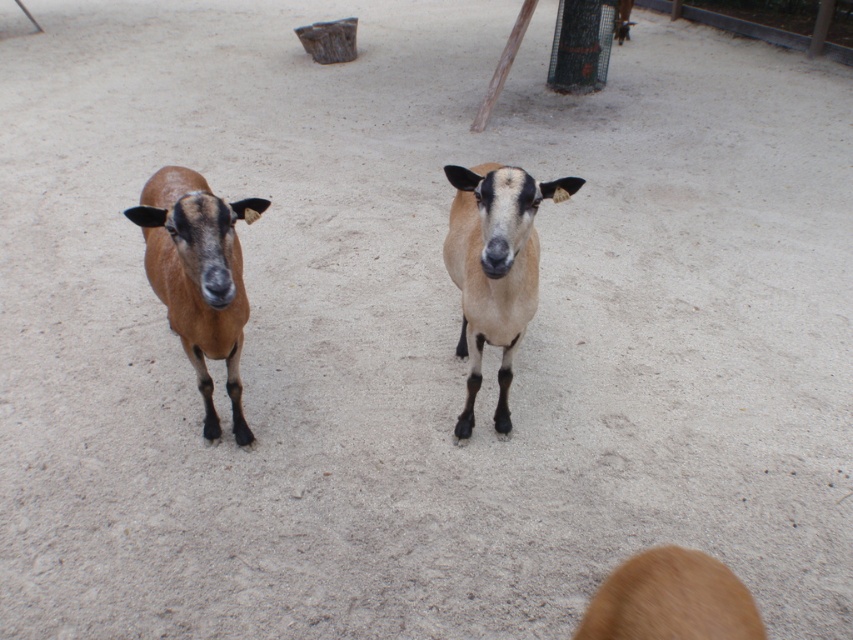
Question: Among these objects, which one is nearest to the camera?

Choices:
 (A) light brown fur goat at center
 (B) brown fur at lower right

Answer: (B)

Question: Is brown matte goat at left wider than brown fur at lower right?

Choices:
 (A) yes
 (B) no

Answer: (A)

Question: Which object appears farthest from the camera in this image?

Choices:
 (A) light brown fur goat at center
 (B) brown matte goat at left
 (C) brown fur at lower right

Answer: (A)

Question: Does brown matte goat at left have a larger size compared to light brown fur goat at center?

Choices:
 (A) no
 (B) yes

Answer: (B)

Question: Can you confirm if brown matte goat at left is smaller than brown fur at lower right?

Choices:
 (A) yes
 (B) no

Answer: (B)

Question: Among these objects, which one is nearest to the camera?

Choices:
 (A) brown fur at lower right
 (B) brown matte goat at left

Answer: (A)